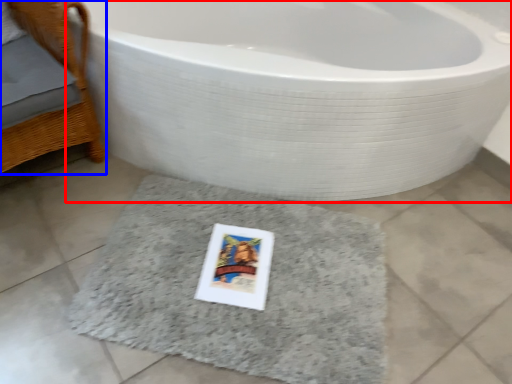
Question: Which point is further to the camera, bathtub (highlighted by a red box) or furniture (highlighted by a blue box)?

Choices:
 (A) bathtub
 (B) furniture

Answer: (B)